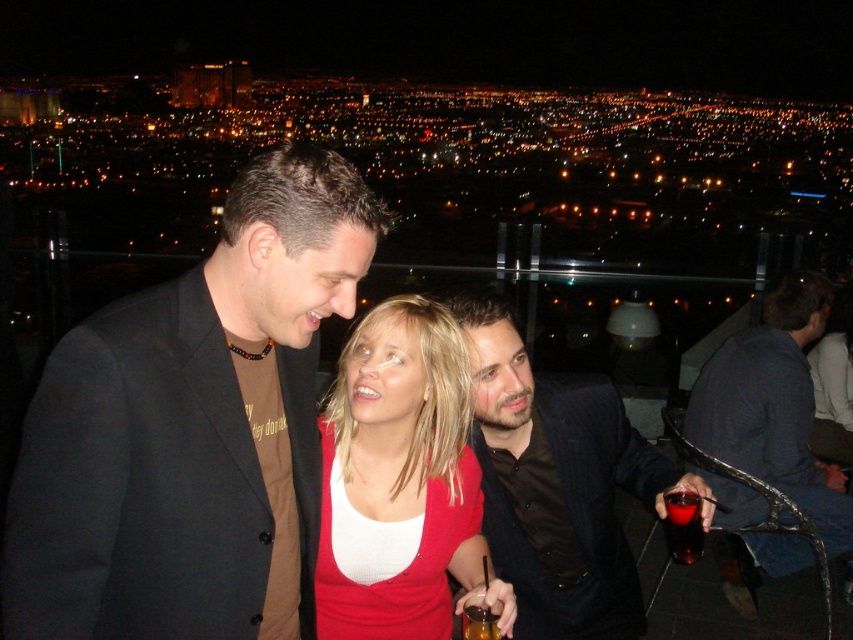
Question: Does matte black jacket at center have a greater width compared to shiny black suit at center?

Choices:
 (A) no
 (B) yes

Answer: (B)

Question: Is matte red sweater at center further to camera compared to shiny black suit at center?

Choices:
 (A) yes
 (B) no

Answer: (B)

Question: Which object is closer to the camera taking this photo?

Choices:
 (A) translucent plastic cup at lower right
 (B) dark blue fabric jacket at right
 (C) shiny black suit at center
 (D) matte black jacket at center

Answer: (A)

Question: Considering the relative positions of shiny black suit at center and translucent plastic cup at lower right in the image provided, where is shiny black suit at center located with respect to translucent plastic cup at lower right?

Choices:
 (A) left
 (B) right

Answer: (A)

Question: Which of the following is the closest to the observer?

Choices:
 (A) (329, 196)
 (B) (469, 515)
 (C) (764, 403)

Answer: (A)

Question: Which point is closer to the camera?

Choices:
 (A) shiny black suit at center
 (B) matte red sweater at center
 (C) translucent amber liquid at lower center
 (D) dark blue fabric jacket at right

Answer: (C)